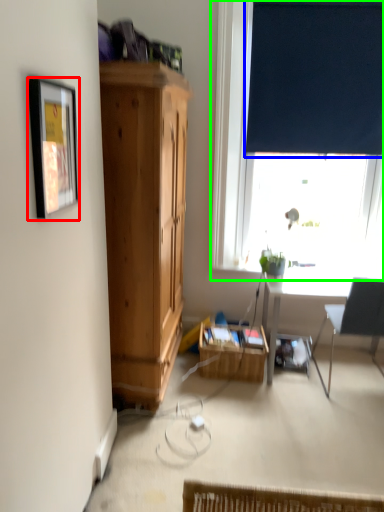
Question: Based on their relative distances, which object is farther from picture frame (highlighted by a red box)? Choose from curtain (highlighted by a blue box) and window (highlighted by a green box).

Choices:
 (A) curtain
 (B) window

Answer: (A)